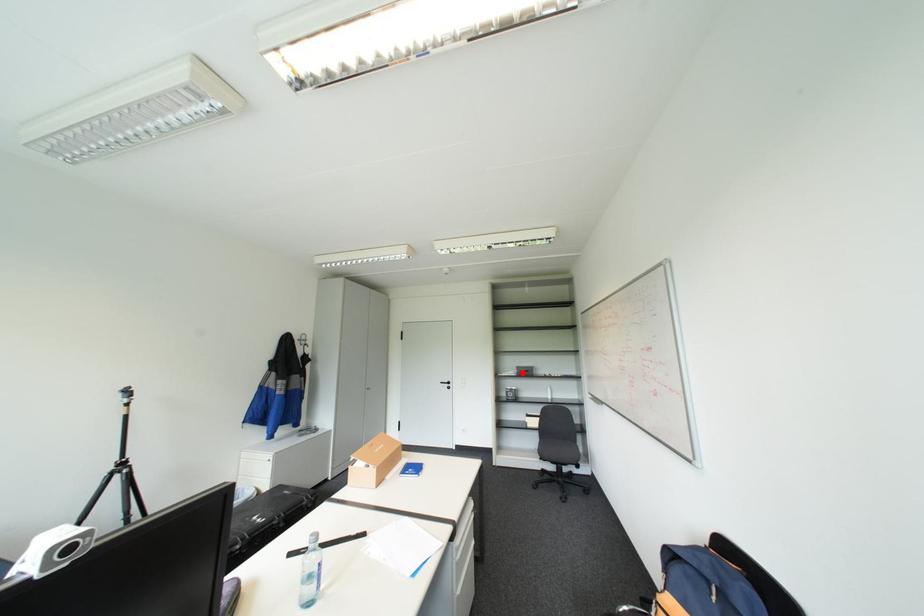
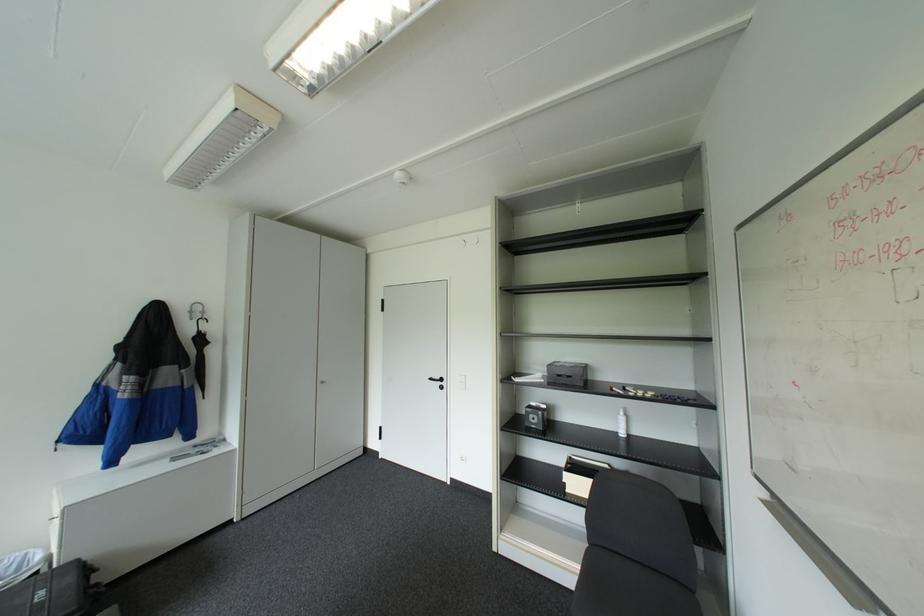
Question: I am providing you with two images of the same scene from different viewpoints. A red point is marked on the first image. Can you still see the location of the red point in image 2?

Choices:
 (A) Yes
 (B) No

Answer: (A)